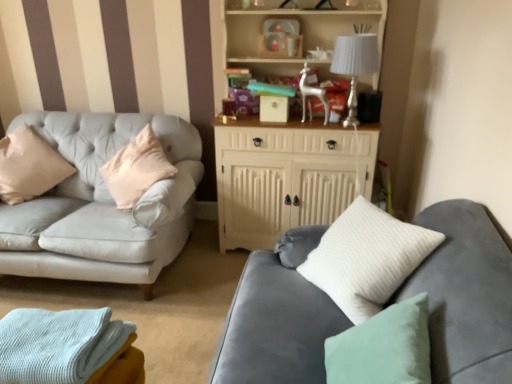
The width and height of the screenshot is (512, 384). What do you see at coordinates (465, 294) in the screenshot? I see `velvet gray couch at lower right` at bounding box center [465, 294].

Measure the distance between velvet gray couch at lower right and camera.

velvet gray couch at lower right is 36.10 inches from camera.

Image resolution: width=512 pixels, height=384 pixels. What are the coordinates of `white fabric lampshade at upper right` in the screenshot? It's located at (355, 65).

In the scene shown: Is velvet gray couch at lower right in contact with white fabric lampshade at upper right?

velvet gray couch at lower right and white fabric lampshade at upper right are clearly separated.

Considering their positions, is velvet gray couch at lower right located in front of or behind white fabric lampshade at upper right?

Clearly, velvet gray couch at lower right is in front of white fabric lampshade at upper right.

Is white fabric lampshade at upper right a part of velvet gray couch at lower right?

No, white fabric lampshade at upper right is not inside velvet gray couch at lower right.

Find the location of a particular element. This screenshot has width=512, height=384. lamp that is behind the velvet gray couch at lower right is located at coordinates (355, 65).

From the image's perspective, is white wood cabinet at upper center beneath velvet gray couch at lower right?

No, from the image's perspective, white wood cabinet at upper center is not beneath velvet gray couch at lower right.

Is white wood cabinet at upper center to the left or to the right of velvet gray couch at lower right in the image?

In the image, white wood cabinet at upper center appears on the left side of velvet gray couch at lower right.

At what (x,y) coordinates should I click in order to perform the action: click on studio couch below the white wood cabinet at upper center (from a real-world perspective). Please return your answer as a coordinate pair (x, y). Looking at the image, I should click on (465, 294).

What's the angular difference between white wood cabinet at upper center and velvet gray couch at lower right's facing directions?

The angle between the facing direction of white wood cabinet at upper center and the facing direction of velvet gray couch at lower right is 87.2 degrees.

Would you consider light blue knitted blanket at lower left to be distant from white wood cabinet at upper center?

Yes, light blue knitted blanket at lower left is far from white wood cabinet at upper center.

What's the angular difference between light blue knitted blanket at lower left and white wood cabinet at upper center's facing directions?

The angular difference between light blue knitted blanket at lower left and white wood cabinet at upper center is 1.38 degrees.

From a real-world perspective, does light blue knitted blanket at lower left stand above white wood cabinet at upper center?

Actually, light blue knitted blanket at lower left is physically below white wood cabinet at upper center in the real world.

Who is shorter, light blue knitted blanket at lower left or velvet gray couch at lower right?

light blue knitted blanket at lower left is shorter.

How different are the orientations of light blue knitted blanket at lower left and velvet gray couch at lower right in degrees?

There is a 85.8-degree angle between the facing directions of light blue knitted blanket at lower left and velvet gray couch at lower right.

How far apart are light blue knitted blanket at lower left and velvet gray couch at lower right?

A distance of 27.43 inches exists between light blue knitted blanket at lower left and velvet gray couch at lower right.

You are a GUI agent. You are given a task and a screenshot of the screen. Output one action in this format:
    pyautogui.click(x=<x>, y=<y>)
    Task: Click on the material located underneath the velvet gray couch at lower right (from a real-world perspective)
    The image size is (512, 384).
    Given the screenshot: What is the action you would take?
    pyautogui.click(x=58, y=344)

Considering the positions of objects white fabric lampshade at upper right and velvet gray couch at lower right in the image provided, who is more to the right, white fabric lampshade at upper right or velvet gray couch at lower right?

From the viewer's perspective, white fabric lampshade at upper right appears more on the right side.

Considering the sizes of white fabric lampshade at upper right and velvet gray couch at lower right in the image, is white fabric lampshade at upper right taller or shorter than velvet gray couch at lower right?

In the image, white fabric lampshade at upper right appears to be shorter than velvet gray couch at lower right.

Is white fabric lampshade at upper right aimed at velvet gray couch at lower right?

Yes.

This screenshot has width=512, height=384. In the image, there is a velvet gray couch at lower right. Identify the location of lamp above it (from the image's perspective). (355, 65).

Which object is further away from the camera, white fabric lampshade at upper right or light blue knitted blanket at lower left?

white fabric lampshade at upper right is behind.

Is point (367, 60) positioned after point (27, 317)?

Yes, point (367, 60) is behind point (27, 317).

Is white fabric lampshade at upper right to the left of light blue knitted blanket at lower left from the viewer's perspective?

In fact, white fabric lampshade at upper right is to the right of light blue knitted blanket at lower left.

Can you confirm if white wood cabinet at upper center is shorter than white fabric lampshade at upper right?

No, white wood cabinet at upper center is not shorter than white fabric lampshade at upper right.

Is white wood cabinet at upper center not near white fabric lampshade at upper right?

No.

The width and height of the screenshot is (512, 384). In order to click on entertainment center on the left of white fabric lampshade at upper right in this screenshot , I will do `click(280, 177)`.

This screenshot has width=512, height=384. I want to click on studio couch in front of the white fabric lampshade at upper right, so click(465, 294).

Locate an element on the screen. This screenshot has width=512, height=384. studio couch on the right of white wood cabinet at upper center is located at coordinates (465, 294).

Looking at the image, which one is located closer to white fabric lampshade at upper right, white wood cabinet at upper center or light blue knitted blanket at lower left?

white wood cabinet at upper center lies closer to white fabric lampshade at upper right than the other object.

Looking at the image, which one is located further to light blue knitted blanket at lower left, velvet gray couch at lower right or white fabric lampshade at upper right?

white fabric lampshade at upper right lies further to light blue knitted blanket at lower left than the other object.

Looking at this image, considering their positions, is white wood cabinet at upper center positioned further to velvet gray couch at lower right than light blue knitted blanket at lower left?

white wood cabinet at upper center.

Which object lies further to the anchor point white fabric lampshade at upper right, light blue knitted blanket at lower left or velvet gray couch at lower right?

Among the two, light blue knitted blanket at lower left is located further to white fabric lampshade at upper right.

Based on their spatial positions, is velvet gray couch at lower right or light blue knitted blanket at lower left closer to white fabric lampshade at upper right?

Based on the image, velvet gray couch at lower right appears to be nearer to white fabric lampshade at upper right.

From the image, which object appears to be nearer to light blue knitted blanket at lower left, white fabric lampshade at upper right or white wood cabinet at upper center?

The object closer to light blue knitted blanket at lower left is white wood cabinet at upper center.

Considering their positions, is white fabric lampshade at upper right positioned further to white wood cabinet at upper center than velvet gray couch at lower right?

velvet gray couch at lower right is positioned further to the anchor white wood cabinet at upper center.

Estimate the real-world distances between objects in this image. Which object is further from light blue knitted blanket at lower left, white fabric lampshade at upper right or velvet gray couch at lower right?

white fabric lampshade at upper right is positioned further to the anchor light blue knitted blanket at lower left.

Locate an element on the screen. Image resolution: width=512 pixels, height=384 pixels. entertainment center between light blue knitted blanket at lower left and white fabric lampshade at upper right is located at coordinates (280, 177).

Where is `material positioned between velvet gray couch at lower right and white wood cabinet at upper center from near to far`? This screenshot has width=512, height=384. material positioned between velvet gray couch at lower right and white wood cabinet at upper center from near to far is located at coordinates (58, 344).

Locate an element on the screen. This screenshot has width=512, height=384. entertainment center positioned between velvet gray couch at lower right and white fabric lampshade at upper right from near to far is located at coordinates (x=280, y=177).

This screenshot has width=512, height=384. What are the coordinates of `material positioned between velvet gray couch at lower right and white fabric lampshade at upper right from near to far` in the screenshot? It's located at (58, 344).